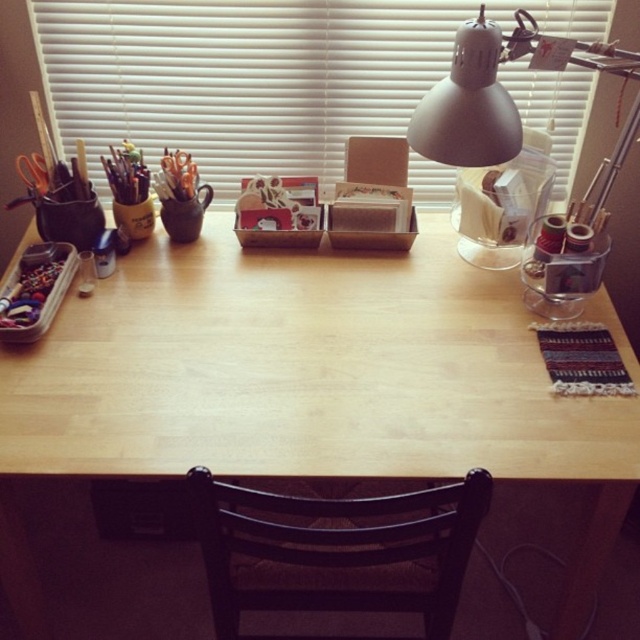
Question: Does white matte blinds at upper center lie behind metallic silver beads at left?

Choices:
 (A) no
 (B) yes

Answer: (B)

Question: Does wooden table at center have a greater width compared to brown wooden chair at lower center?

Choices:
 (A) no
 (B) yes

Answer: (B)

Question: Estimate the real-world distances between objects in this image. Which object is closer to the metallic silver beads at left?

Choices:
 (A) wooden table at center
 (B) brown wooden chair at lower center

Answer: (A)

Question: Is brown wooden chair at lower center to the right of metallic silver beads at left from the viewer's perspective?

Choices:
 (A) yes
 (B) no

Answer: (A)

Question: Which of the following is the farthest from the observer?

Choices:
 (A) (60, 284)
 (B) (330, 554)

Answer: (A)

Question: Which object appears closest to the camera in this image?

Choices:
 (A) white matte blinds at upper center
 (B) brown wooden chair at lower center

Answer: (B)